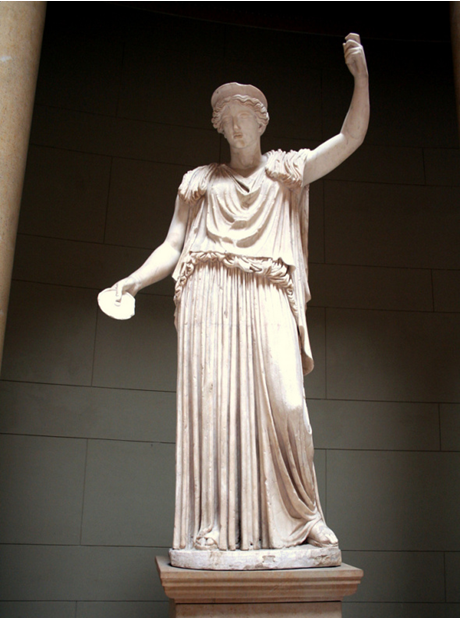
Locate an element on the screen. The image size is (461, 618). fabric drapes is located at coordinates (247, 219), (245, 237), (285, 447), (284, 480), (232, 466), (208, 227), (226, 384), (207, 502).